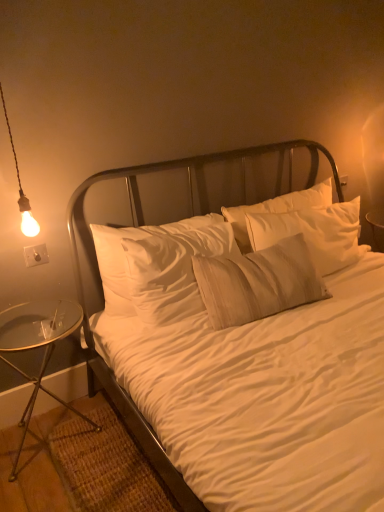
Question: Is metallic silver headboard at center in front of or behind transparent glass table at lower left in the image?

Choices:
 (A) behind
 (B) front

Answer: (A)

Question: Looking at their shapes, would you say metallic silver headboard at center is wider or thinner than transparent glass table at lower left?

Choices:
 (A) thin
 (B) wide

Answer: (A)

Question: Which object is positioned closest to the metallic silver headboard at center?

Choices:
 (A) transparent glass table at lower left
 (B) white cotton bed at center
 (C) matte bulb at left

Answer: (A)

Question: Which object is positioned closest to the metallic silver headboard at center?

Choices:
 (A) white cotton bed at center
 (B) matte bulb at left
 (C) transparent glass table at lower left

Answer: (C)